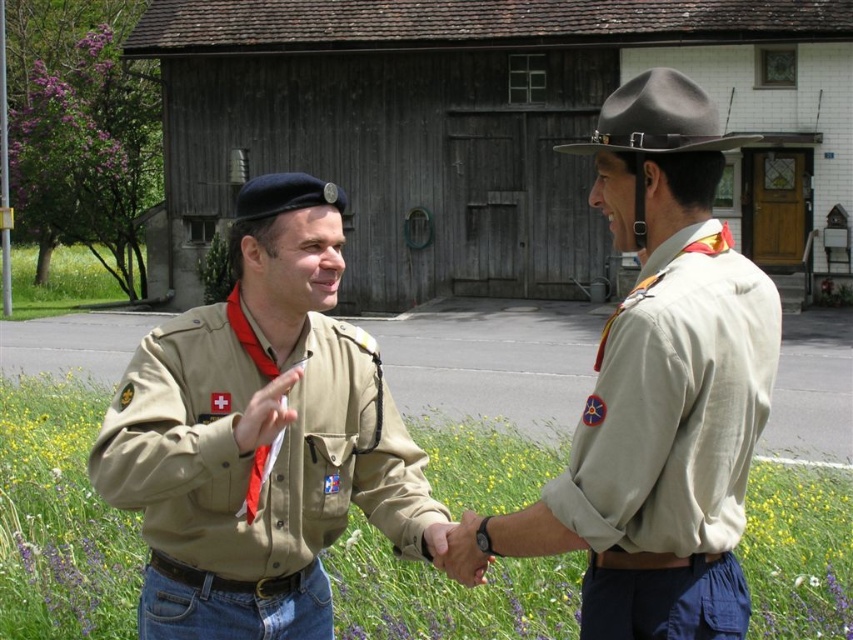
Is smooth leather hand at center closer to the viewer compared to matte khaki shirt at center?

No, smooth leather hand at center is behind matte khaki shirt at center.

You are a GUI agent. You are given a task and a screenshot of the screen. Output one action in this format:
    pyautogui.click(x=<x>, y=<y>)
    Task: Click on the smooth leather hand at center
    The image size is (853, 640).
    Given the screenshot: What is the action you would take?
    pyautogui.click(x=457, y=548)

Between point (433, 528) and point (283, 413), which one is positioned in front?

Point (283, 413) is in front.

What are the coordinates of `smooth leather hand at center` in the screenshot? It's located at (457, 548).

Is point (700, 144) positioned before point (461, 528)?

That is True.

Is brown felt cowboy hat at upper center smaller than smooth leather hand at center?

Actually, brown felt cowboy hat at upper center might be larger than smooth leather hand at center.

Does point (631, 145) come behind point (428, 552)?

No, (631, 145) is in front of (428, 552).

At what (x,y) coordinates should I click in order to perform the action: click on brown felt cowboy hat at upper center. Please return your answer as a coordinate pair (x, y). The image size is (853, 640). Looking at the image, I should click on (656, 128).

Is gray felt cowboy hat at upper center bigger than matte khaki shirt at center?

Yes.

Based on the photo, between gray felt cowboy hat at upper center and matte khaki shirt at center, which one has more height?

With more height is gray felt cowboy hat at upper center.

Find the location of a particular element. gray felt cowboy hat at upper center is located at coordinates (657, 118).

Where is `gray felt cowboy hat at upper center`? The width and height of the screenshot is (853, 640). gray felt cowboy hat at upper center is located at coordinates (657, 118).